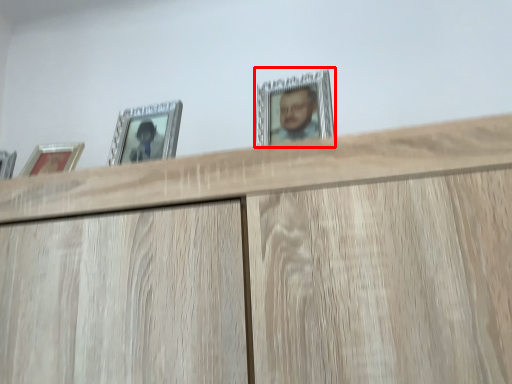
Question: From the image's perspective, where is picture frame (annotated by the red box) located in relation to picture frame in the image?

Choices:
 (A) above
 (B) below

Answer: (A)